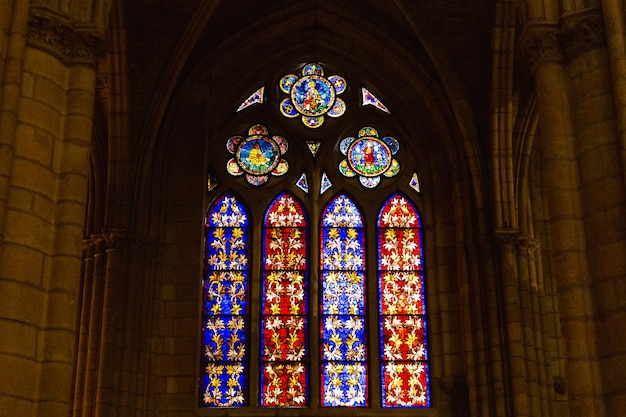
Find the location of `small windows`. small windows is located at coordinates (217, 183), (302, 183), (257, 95), (315, 149), (325, 180), (413, 183), (370, 100).